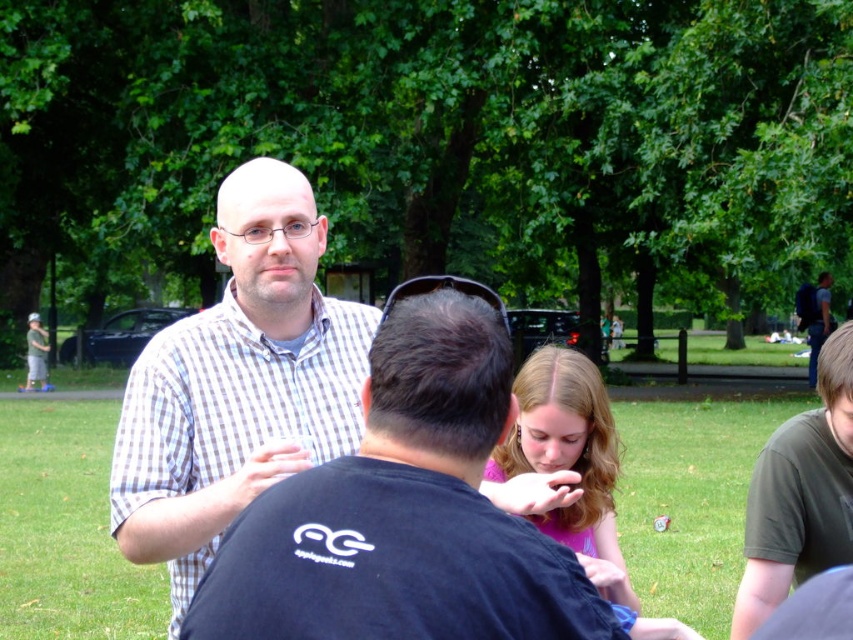
You are standing at the origin point of the coordinate system in the image. You want to walk to the green grass at center. What direction should you move in to reach it?

Since the 2D location of the green grass at center is at point (65, 531), you should move towards the right and slightly downward from your current position at the origin to reach it.